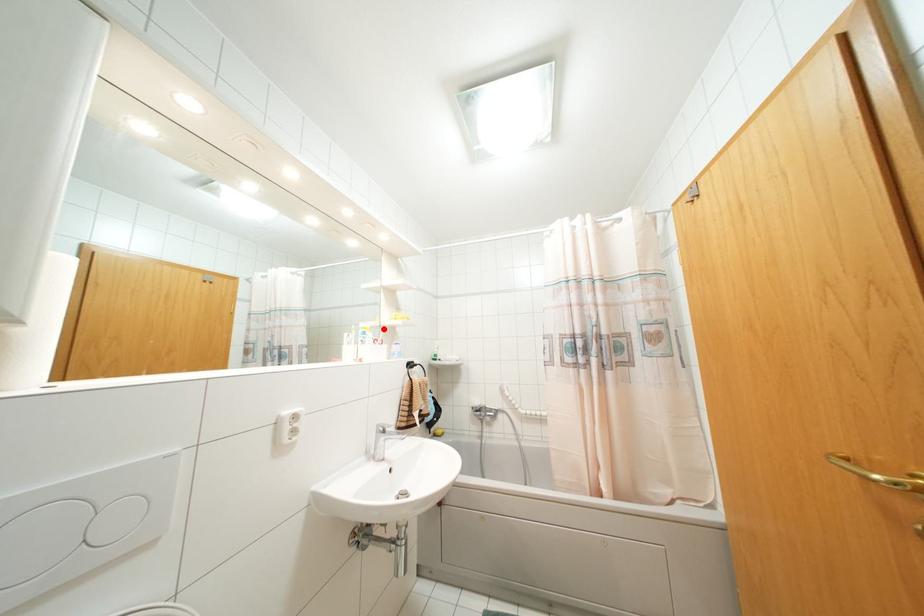
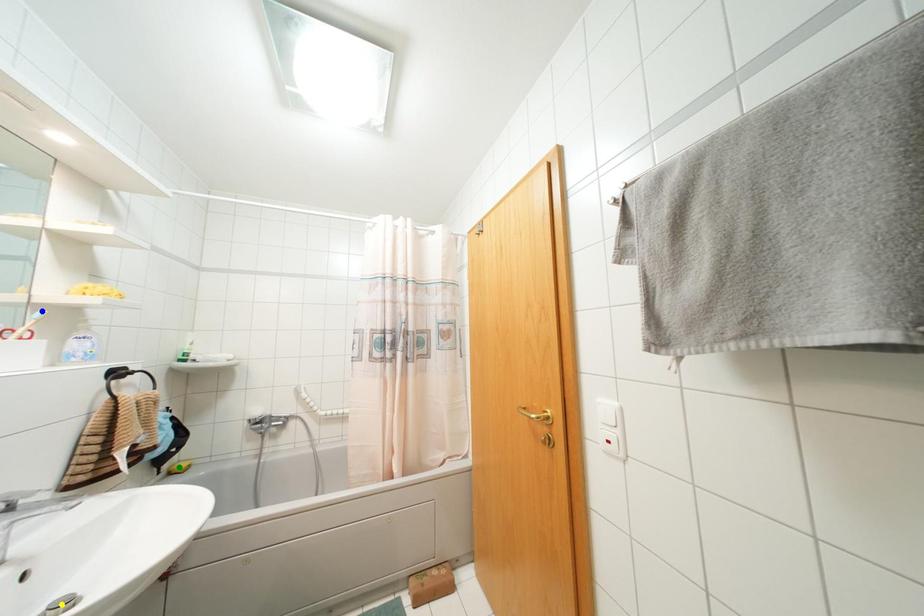
Question: I am providing you with two images of the same scene from different viewpoints. A red point is marked on the first image. You are given multiple points on the second image. Which spot in image 2 lines up with the point in image 1?

Choices:
 (A) blue point
 (B) green point
 (C) yellow point

Answer: (A)